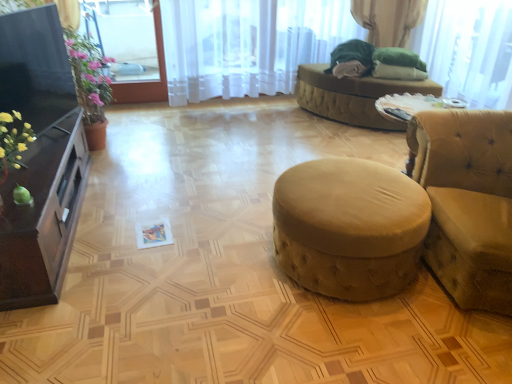
Question: Considering the relative positions of suede-like beige stool at center and beige fabric ottoman at center in the image provided, is suede-like beige stool at center behind beige fabric ottoman at center?

Choices:
 (A) no
 (B) yes

Answer: (A)

Question: Does suede-like beige stool at center have a greater height compared to beige fabric ottoman at center?

Choices:
 (A) no
 (B) yes

Answer: (A)

Question: Is suede-like beige stool at center bigger than beige fabric ottoman at center?

Choices:
 (A) no
 (B) yes

Answer: (A)

Question: Can you confirm if suede-like beige stool at center is shorter than beige fabric ottoman at center?

Choices:
 (A) no
 (B) yes

Answer: (B)

Question: Could you tell me if suede-like beige stool at center is facing beige fabric ottoman at center?

Choices:
 (A) no
 (B) yes

Answer: (A)

Question: Is beige fabric ottoman at center spatially inside white sheer curtain at upper center, or outside of it?

Choices:
 (A) outside
 (B) inside

Answer: (A)

Question: Visually, is beige fabric ottoman at center positioned to the left or to the right of white sheer curtain at upper center?

Choices:
 (A) right
 (B) left

Answer: (A)

Question: In the image, is beige fabric ottoman at center positioned in front of or behind white sheer curtain at upper center?

Choices:
 (A) front
 (B) behind

Answer: (A)

Question: From the image's perspective, is beige fabric ottoman at center located above or below white sheer curtain at upper center?

Choices:
 (A) below
 (B) above

Answer: (A)

Question: From a real-world perspective, relative to translucent fabric at upper right, arranged as the 1th window screen when viewed from the right, is white sheer curtain at upper center vertically above or below?

Choices:
 (A) above
 (B) below

Answer: (B)

Question: From the image's perspective, is white sheer curtain at upper center positioned above or below translucent fabric at upper right, arranged as the 1th window screen when viewed from the right?

Choices:
 (A) below
 (B) above

Answer: (B)

Question: Would you say white sheer curtain at upper center is to the left or to the right of translucent fabric at upper right, arranged as the 1th window screen when viewed from the right, in the picture?

Choices:
 (A) left
 (B) right

Answer: (A)

Question: From their relative heights in the image, would you say white sheer curtain at upper center is taller or shorter than translucent fabric at upper right, which is the second window screen from left to right?

Choices:
 (A) short
 (B) tall

Answer: (B)

Question: Is suede-like beige stool at center taller or shorter than matte black cabinet at left?

Choices:
 (A) tall
 (B) short

Answer: (A)

Question: Would you say suede-like beige stool at center is to the left or to the right of matte black cabinet at left in the picture?

Choices:
 (A) left
 (B) right

Answer: (B)